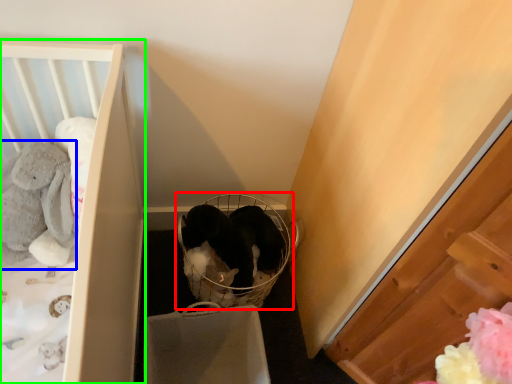
Question: Which is farther away from baby carriage (highlighted by a red box)? animal (highlighted by a blue box) or furniture (highlighted by a green box)?

Choices:
 (A) animal
 (B) furniture

Answer: (A)